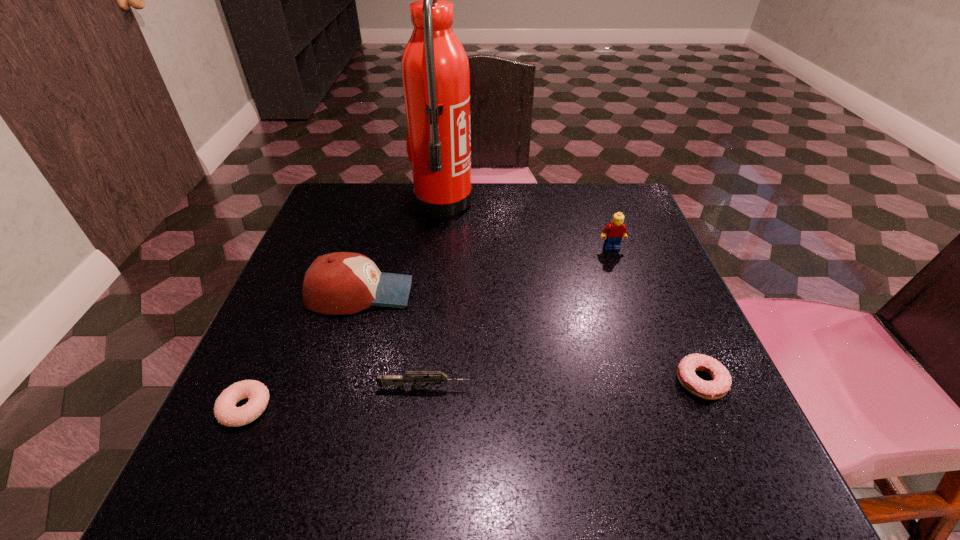
I want to click on the farthest object, so click(435, 70).

Image resolution: width=960 pixels, height=540 pixels. Identify the location of fire extinguisher. (435, 70).

Locate an element on the screen. baseball cap is located at coordinates (338, 283).

Image resolution: width=960 pixels, height=540 pixels. In order to click on Lego in this screenshot , I will do `click(613, 233)`.

The height and width of the screenshot is (540, 960). In order to click on gun in this screenshot , I will do `click(399, 380)`.

What are the coordinates of `the right doughnut` in the screenshot? It's located at (721, 382).

Identify the location of the left doughnut. (225, 411).

You are a GUI agent. You are given a task and a screenshot of the screen. Output one action in this format:
    pyautogui.click(x=<x>, y=<y>)
    Task: Click on the free location located 0.220m on the label side of the tallest object
    The image size is (960, 540).
    Given the screenshot: What is the action you would take?
    pyautogui.click(x=558, y=204)

Locate an element on the screen. vacant space located 0.060m on the front-facing side of the baseball cap is located at coordinates (442, 294).

Locate an element on the screen. free region located 0.140m on the front-facing side of the Lego is located at coordinates (628, 294).